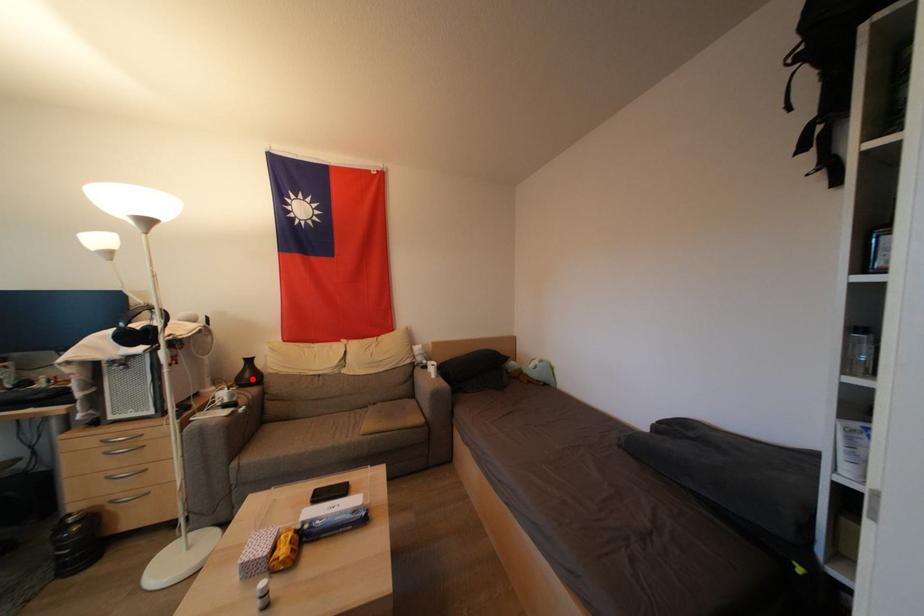
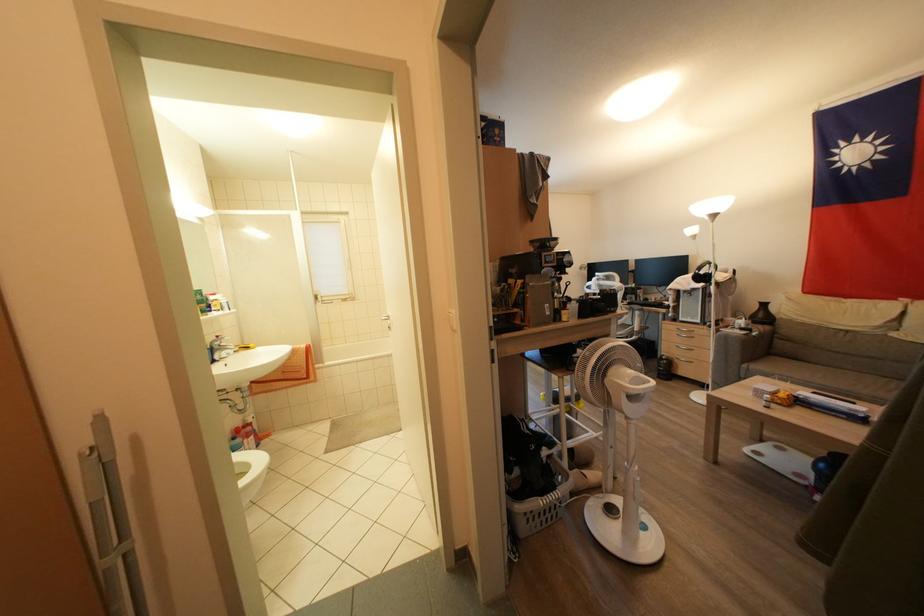
The point at the highlighted location is marked in the first image. Where is the corresponding point in the second image?

(766, 320)